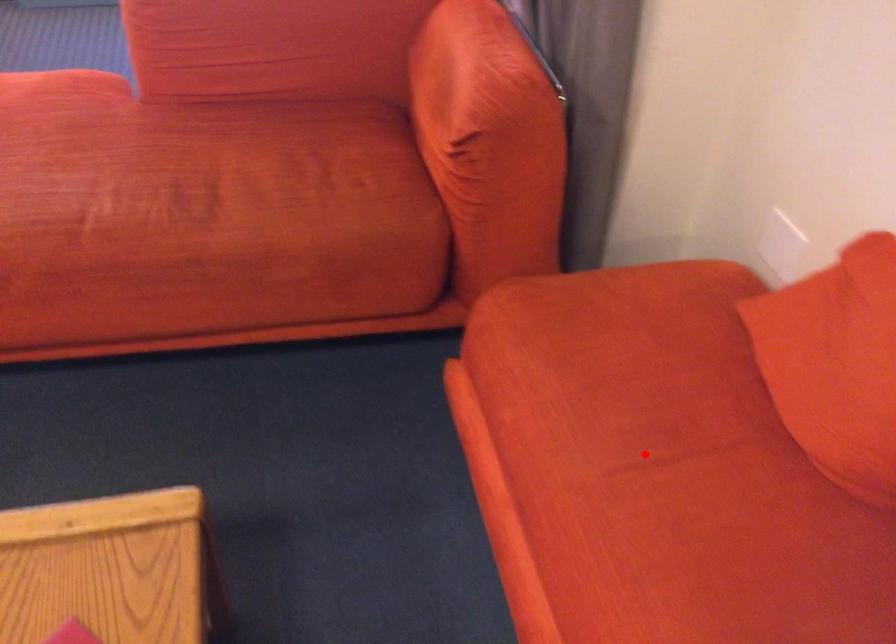
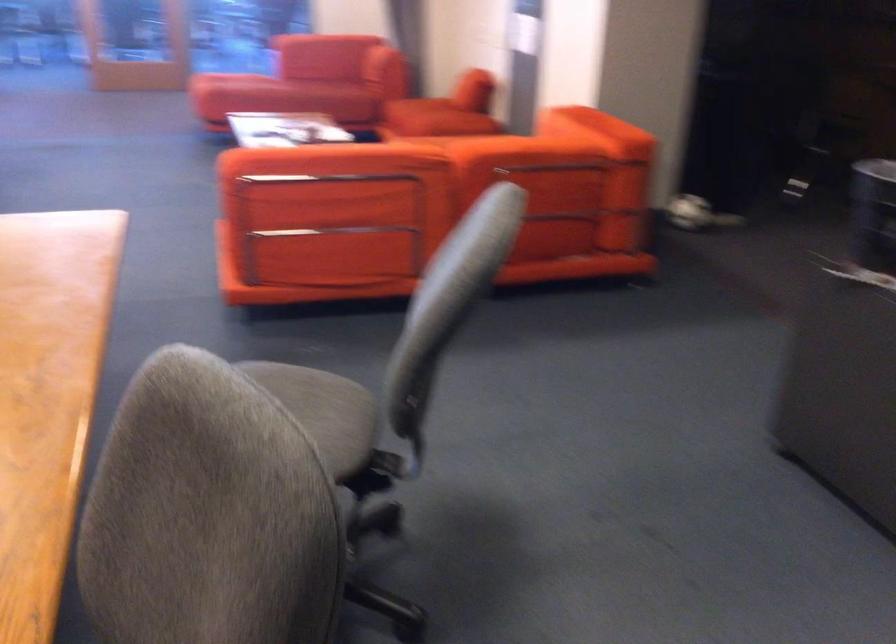
Question: I am providing you with two images of the same scene from different viewpoints. A red point is marked on the first image. Is the red point's position out of view in image 2?

Choices:
 (A) Yes
 (B) No

Answer: (A)